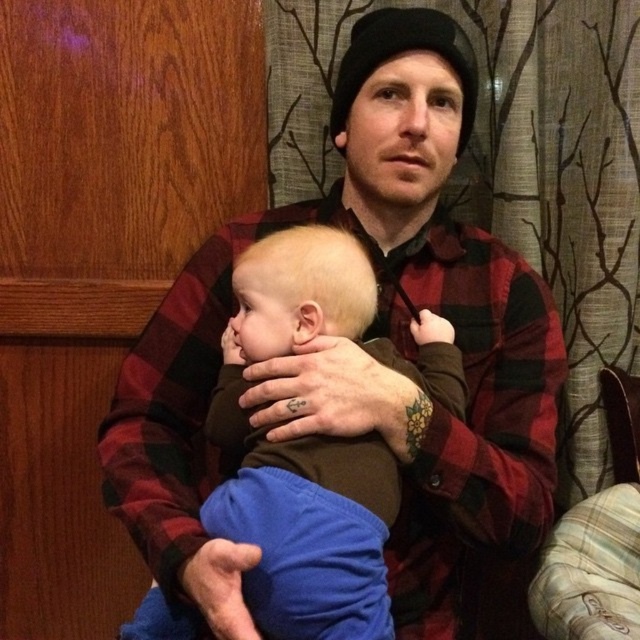
Question: Does flannel shirt at center come behind brown soft fabric baby at center?

Choices:
 (A) no
 (B) yes

Answer: (A)

Question: Among these points, which one is farthest from the camera?

Choices:
 (A) (452, 154)
 (B) (371, 296)

Answer: (A)

Question: Is flannel shirt at center bigger than brown soft fabric baby at center?

Choices:
 (A) yes
 (B) no

Answer: (A)

Question: Which of the following is the farthest from the observer?

Choices:
 (A) (396, 356)
 (B) (196, 253)

Answer: (B)

Question: Is flannel shirt at center bigger than brown soft fabric baby at center?

Choices:
 (A) no
 (B) yes

Answer: (B)